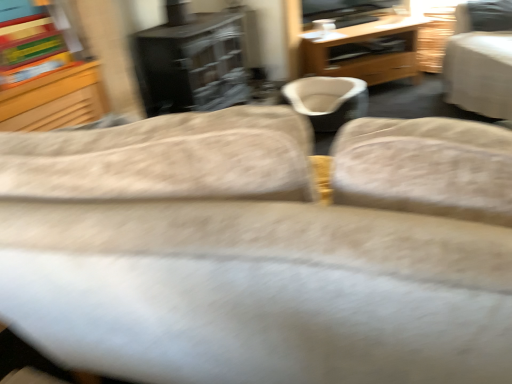
Question: Considering the positions of beige fabric bean bag chair at center and light gray fabric chair at upper right in the image, is beige fabric bean bag chair at center wider or thinner than light gray fabric chair at upper right?

Choices:
 (A) thin
 (B) wide

Answer: (A)

Question: From the image's perspective, relative to light gray fabric chair at upper right, is beige fabric bean bag chair at center above or below?

Choices:
 (A) above
 (B) below

Answer: (B)

Question: Estimate the real-world distances between objects in this image. Which object is farther from the wooden desk at center?

Choices:
 (A) light gray fabric chair at upper right
 (B) beige fabric bean bag chair at center

Answer: (A)

Question: Which of these objects is positioned closest to the beige fabric bean bag chair at center?

Choices:
 (A) wooden desk at center
 (B) light gray fabric chair at upper right

Answer: (A)